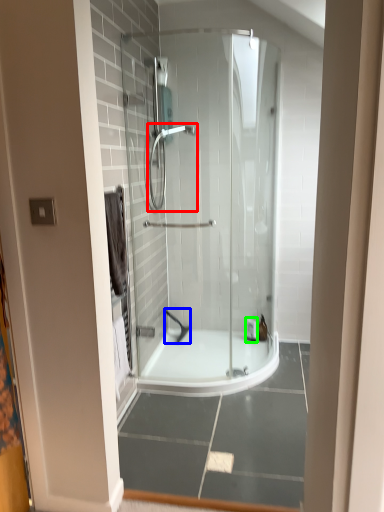
Question: Estimate the real-world distances between objects in this image. Which object is closer to shower (highlighted by a red box), shower (highlighted by a blue box) or toiletry (highlighted by a green box)?

Choices:
 (A) shower
 (B) toiletry

Answer: (A)